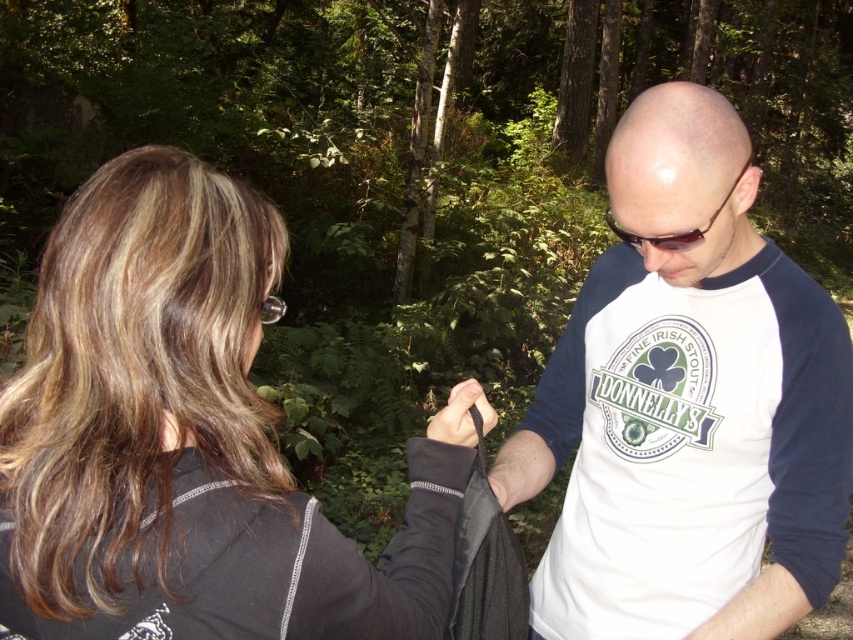
Question: Which object is farther from the camera taking this photo?

Choices:
 (A) black plastic goggles at upper center
 (B) black fabric jacket at left

Answer: (A)

Question: Is black fabric jacket at left further to camera compared to white fabric shirt at center?

Choices:
 (A) no
 (B) yes

Answer: (A)

Question: Which of the following is the farthest from the observer?

Choices:
 (A) (614, 228)
 (B) (772, 493)
 (C) (1, 515)

Answer: (B)

Question: Which object appears closest to the camera in this image?

Choices:
 (A) black fabric jacket at left
 (B) black plastic goggles at upper center

Answer: (A)

Question: Is black fabric jacket at left thinner than black plastic goggles at upper center?

Choices:
 (A) yes
 (B) no

Answer: (B)

Question: Does black fabric jacket at left appear on the right side of black plastic goggles at upper center?

Choices:
 (A) yes
 (B) no

Answer: (B)